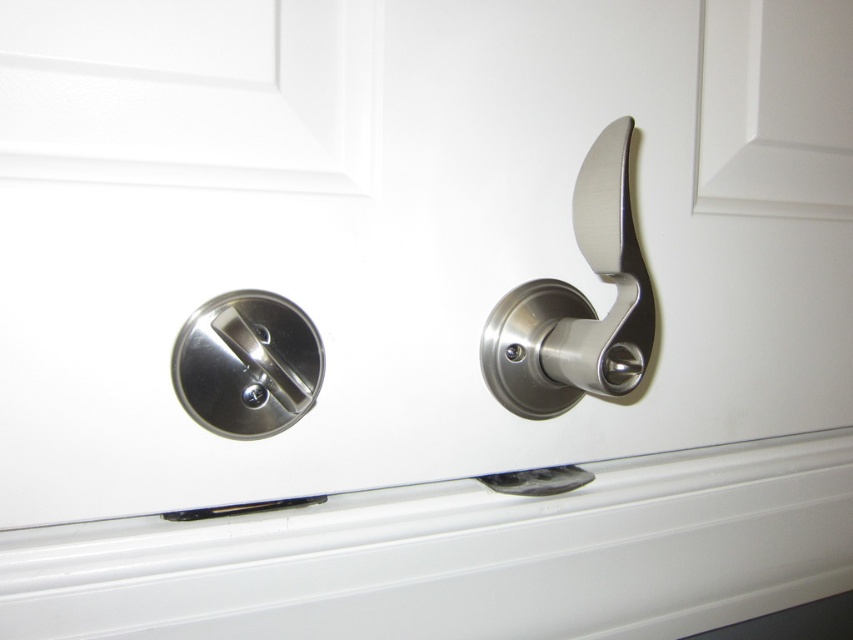
Between satin nickel lever at right and satin nickel lock at center, which one is positioned lower?

satin nickel lock at center is below.

Between satin nickel lever at right and satin nickel lock at center, which one has less height?

With less height is satin nickel lock at center.

Is point (556, 340) closer to camera compared to point (233, 317)?

No.

Identify the location of satin nickel lever at right. The height and width of the screenshot is (640, 853). (578, 304).